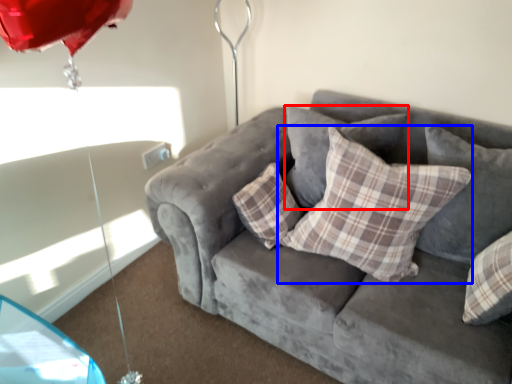
Question: Among these objects, which one is nearest to the camera, pillow (highlighted by a red box) or pillow (highlighted by a blue box)?

Choices:
 (A) pillow
 (B) pillow

Answer: (B)